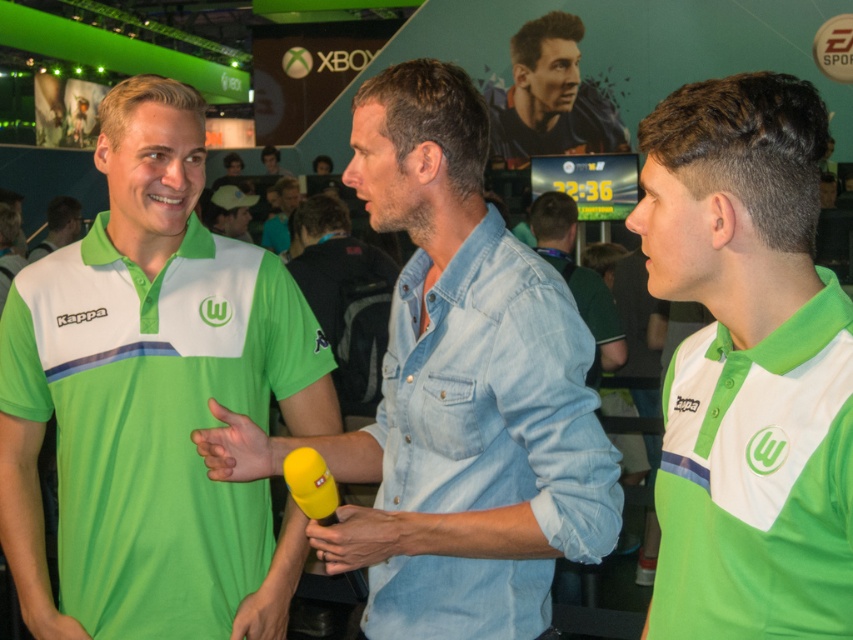
You are attending a sports event and see a man in a light blue denim shirt at center and another in a dark blue jersey at upper center. Which one is nearer to you?

The light blue denim shirt at center is closer to the viewer than the dark blue jersey at upper center.

You are a photographer at the event and need to capture a photo where both the denim shirt at center and the green jersey at center are visible. Which object should you position closer to the camera to ensure both are fully visible in the frame?

The denim shirt at center is much taller than the green jersey at center, so positioning the denim shirt at center closer to the camera will help ensure both are fully visible in the frame.

Based on the photo, you are a photographer at the event and need to ensure that both the denim shirt at center and the green jersey at center are visible in your photo. Given that your camera has a focus limit of 1 meter, can you fit both objects in the frame without zooming out?

The denim shirt at center is smaller than the green jersey at center, but the question of fitting both into the frame depends on their spatial arrangement and distance from the camera. Since the description only provides size comparison and not positional details, it is unclear if they are within the 1 meter focus range. Additional information about their placement relative to the camera is needed to determine visibility.